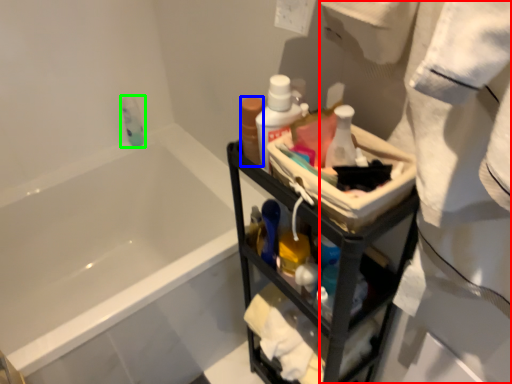
Question: Based on their relative distances, which object is nearer to bath towel (highlighted by a red box)? Choose from mouthwash (highlighted by a blue box) and mouthwash (highlighted by a green box).

Choices:
 (A) mouthwash
 (B) mouthwash

Answer: (A)